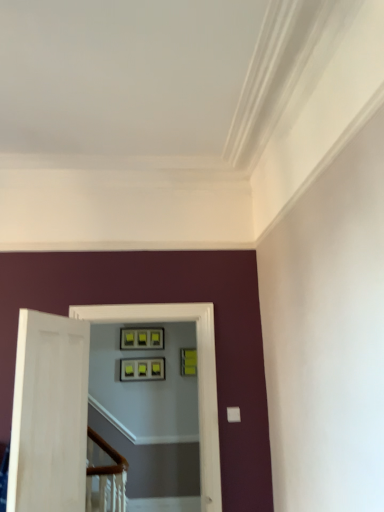
Question: In terms of size, does matte black frames at center appear bigger or smaller than green matte picture frame at upper center, the 1th picture frame positioned from the right?

Choices:
 (A) small
 (B) big

Answer: (B)

Question: Is matte black frames at center inside or outside of green matte picture frame at upper center, which is the 2th picture frame from left to right?

Choices:
 (A) outside
 (B) inside

Answer: (A)

Question: Which is farther from the matte black picture frame at center, which is the second picture frame from right to left?

Choices:
 (A) green matte picture frame at upper center, which is the 2th picture frame from left to right
 (B) matte black frames at center

Answer: (B)

Question: Estimate the real-world distances between objects in this image. Which object is closer to the matte black frames at center?

Choices:
 (A) green matte picture frame at upper center, the 1th picture frame positioned from the right
 (B) matte black picture frame at center, which is the second picture frame from right to left

Answer: (B)